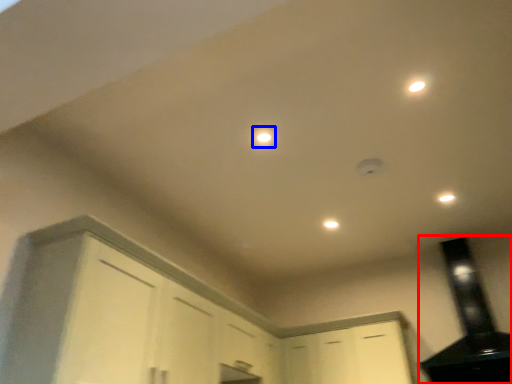
Question: Which of the following is the farthest to the observer, exhaust hood (highlighted by a red box) or light (highlighted by a blue box)?

Choices:
 (A) exhaust hood
 (B) light

Answer: (A)